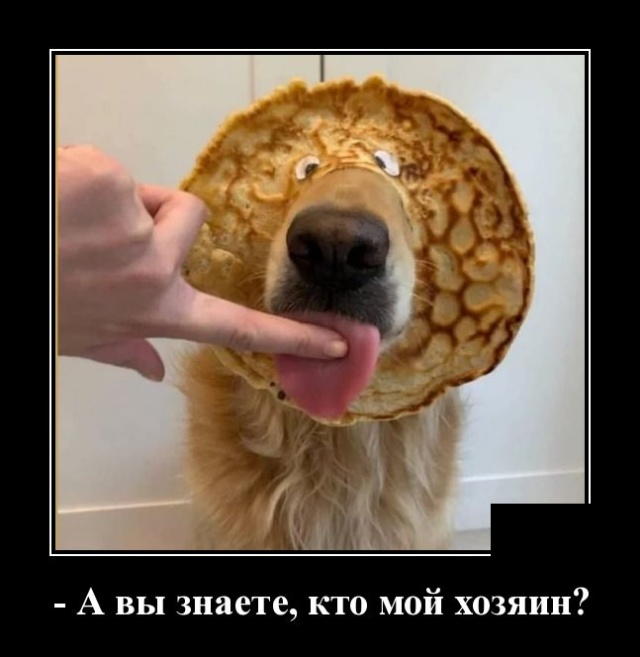
This screenshot has height=657, width=640. I want to click on wall, so click(283, 47).